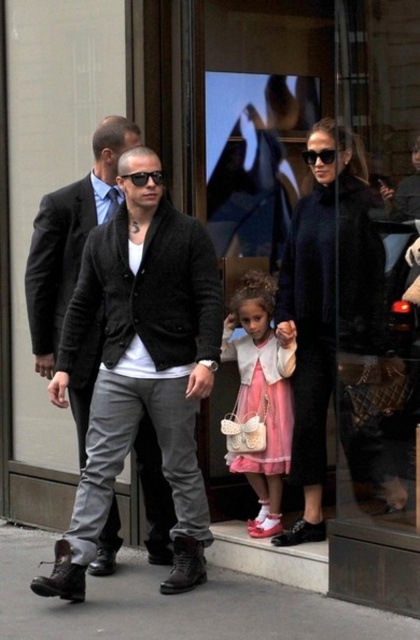
You are standing on the sidewalk and see the dark gray knit cardigan at center and the concrete pavement at lower center. Which one is closer to you?

The dark gray knit cardigan at center is closer to you because it is further to the viewer than the concrete pavement at lower center.

You are standing on the sidewalk and see the concrete pavement at lower center and the pink satin dress at center. Which object is closer to your right side?

The pink satin dress at center is closer to your right side because the concrete pavement at lower center is to its left.

You are standing on the sidewalk and want to cross the street to reach the store. The crosswalk is located at the concrete pavement at lower center. If your walking speed is 1.4 meters per second, how many seconds will it take you to reach the crosswalk?

The distance between you and the concrete pavement at lower center is 3.85 meters. At a walking speed of 1.4 meters per second, it would take approximately 2.75 seconds to reach the crosswalk.